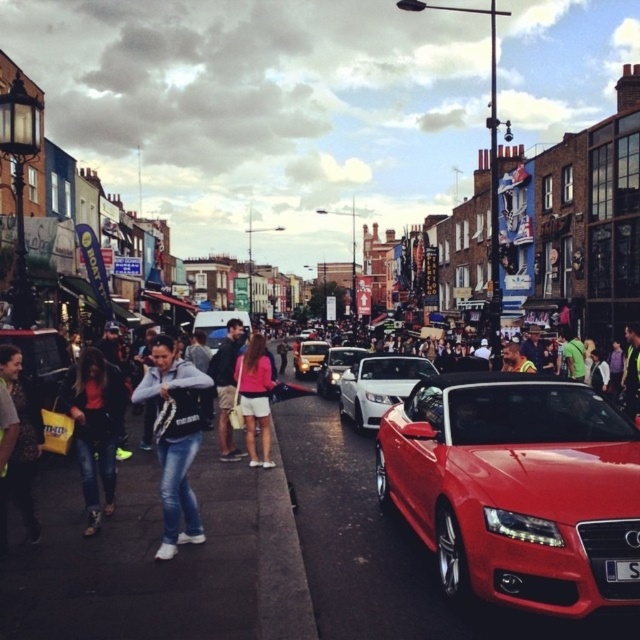
Question: Based on their relative distances, which object is farther from the shiny red convertible at center?

Choices:
 (A) pink fabric shorts at center
 (B) white glossy car at center

Answer: (B)

Question: Considering the relative positions of shiny red convertible at center and denim jacket at center in the image provided, where is shiny red convertible at center located with respect to denim jacket at center?

Choices:
 (A) left
 (B) right

Answer: (B)

Question: Which point is closer to the camera?

Choices:
 (A) (552, 460)
 (B) (308, 353)

Answer: (A)

Question: Which point appears farthest from the camera in this image?

Choices:
 (A) (250, 419)
 (B) (346, 346)
 (C) (224, 364)
 (D) (584, 392)

Answer: (B)

Question: Can you confirm if matte black crowd at center is positioned below matte gold van at center?

Choices:
 (A) yes
 (B) no

Answer: (A)

Question: Does matte black jacket at lower left have a greater width compared to dark blue jeans at center?

Choices:
 (A) no
 (B) yes

Answer: (A)